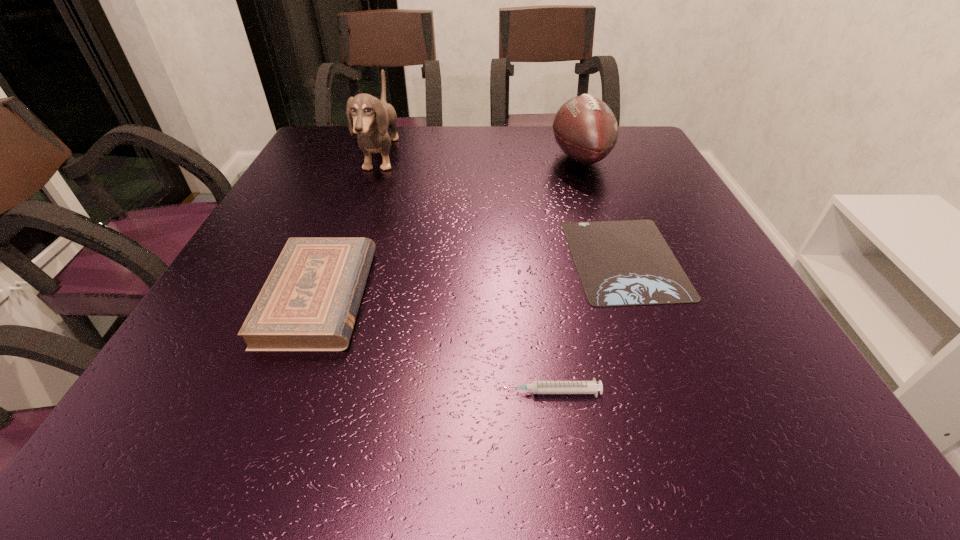
The width and height of the screenshot is (960, 540). I want to click on vacant space at the far edge of the desktop, so click(x=502, y=133).

This screenshot has height=540, width=960. In the image, there is a desktop. In order to click on vacant area at the near edge in this screenshot , I will do `click(521, 446)`.

The height and width of the screenshot is (540, 960). I want to click on free region at the left edge of the desktop, so tap(238, 303).

Identify the location of vacant space at the far left corner of the desktop. (340, 132).

The width and height of the screenshot is (960, 540). I want to click on vacant position at the near left corner of the desktop, so click(x=227, y=419).

In the image, there is a desktop. Where is `vacant area at the far right corner`? vacant area at the far right corner is located at coordinates (636, 133).

At what (x,y) coordinates should I click in order to perform the action: click on free area in between the puppy and the mousepad. Please return your answer as a coordinate pair (x, y). The image size is (960, 540). Looking at the image, I should click on (503, 208).

Locate an element on the screen. free spot between the third tallest object and the second tallest object is located at coordinates (449, 227).

Identify the location of vacant point located between the tallest object and the second shortest object. (465, 274).

Find the location of a particular element. empty space that is in between the shortest object and the second tallest object is located at coordinates (603, 208).